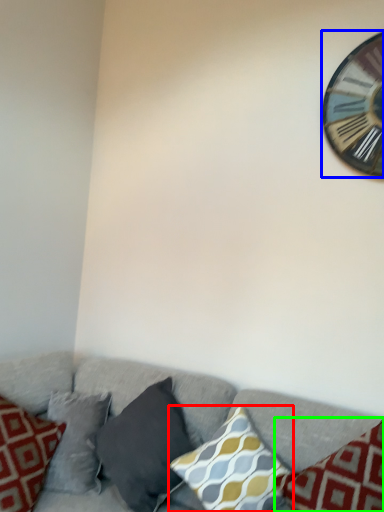
Question: Considering the real-world distances, which object is farthest from pillow (highlighted by a red box)? wall clock (highlighted by a blue box) or pillow (highlighted by a green box)?

Choices:
 (A) wall clock
 (B) pillow

Answer: (A)